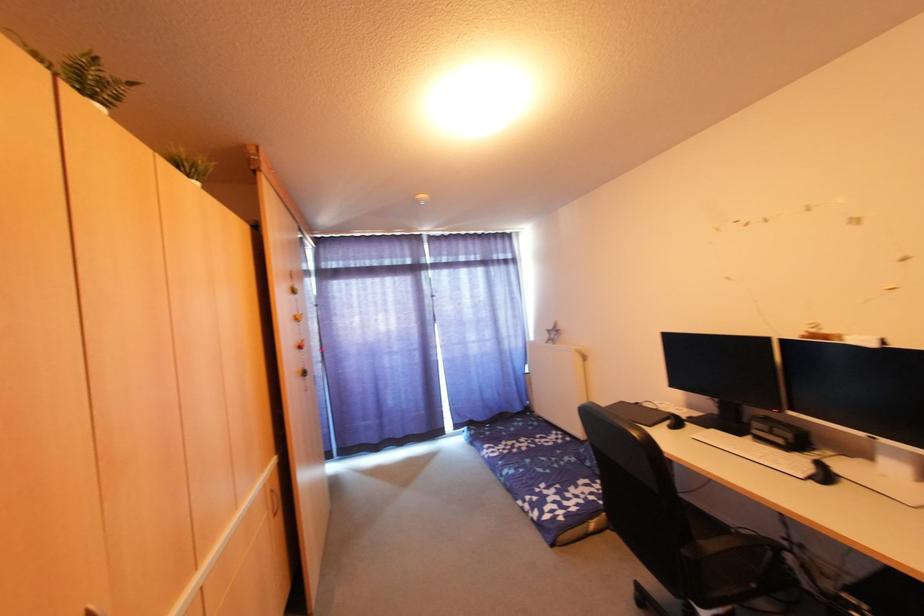
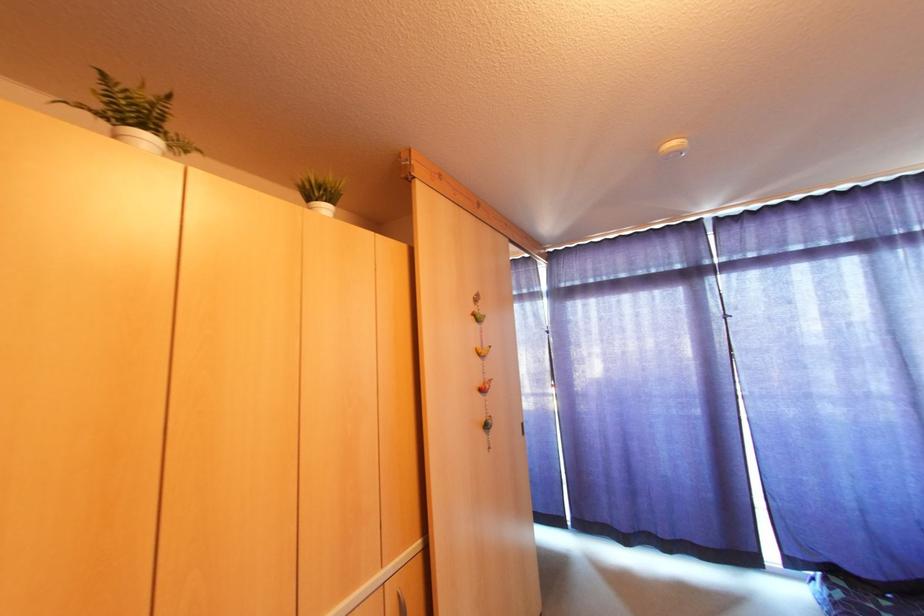
Question: How did the camera likely rotate?

Choices:
 (A) Left
 (B) Right
 (C) Up
 (D) Down

Answer: (A)